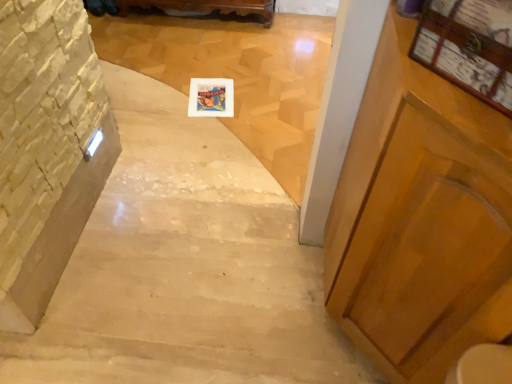
Where is `free space above white marble stairs at center, the 1th stairwell in the right-to-left sequence (from a real-world perspective)`? This screenshot has width=512, height=384. free space above white marble stairs at center, the 1th stairwell in the right-to-left sequence (from a real-world perspective) is located at coordinates (220, 95).